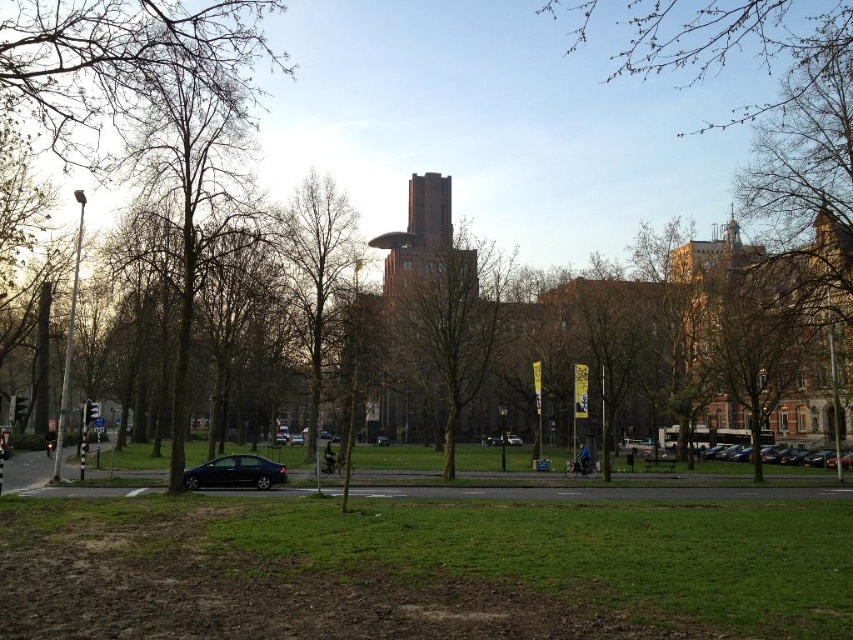
You are a delivery driver who needs to park your shiny silver car at center in a parking lot located 50 meters away from your current position. Can you safely reach the parking lot without exceeding the distance limit?

The distance between the shiny silver car at center and the camera is 52.75 meters, which exceeds the 50 meters parking lot distance limit. Therefore, you cannot safely reach the parking lot without exceeding the distance limit.

You are a delivery person who needs to park your truck, which is 2 meters tall, in this parking lot. Looking at the shiny silver car at center and the black matte car at center, which one can you park next to without hitting the roof?

The shiny silver car at center is taller than the black matte car at center. Since your truck is 2 meters tall, you should park next to the black matte car at center to avoid hitting the roof.

You are standing at the center of the paved road in the urban park scene. Looking towards the left side of the image, you notice a point marked at coordinates (194,163). What object is located at this point?

The point at coordinates (194,163) corresponds to bare branches at left.